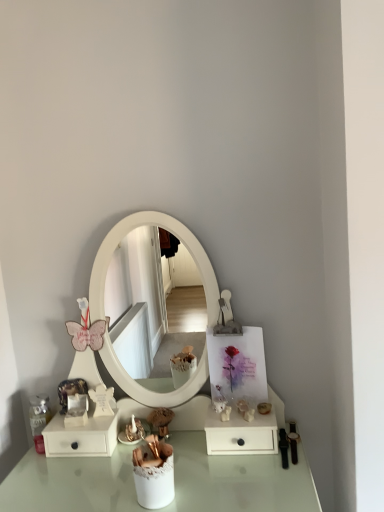
The height and width of the screenshot is (512, 384). Identify the location of free point above white matte drawer at lower right, which ranks as the 1th dresser in right-to-left order (from a real-world perspective). (245, 412).